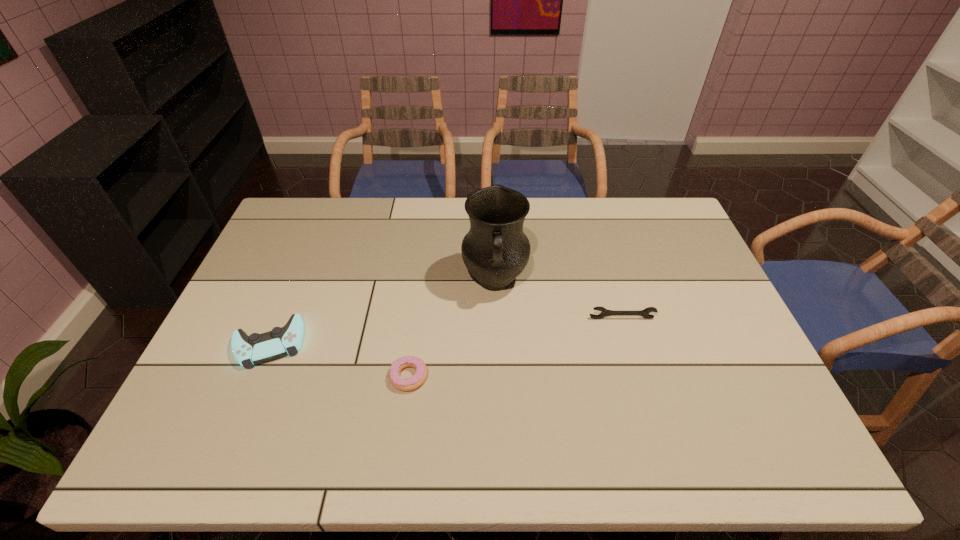
The height and width of the screenshot is (540, 960). I want to click on pitcher, so click(495, 250).

You are a GUI agent. You are given a task and a screenshot of the screen. Output one action in this format:
    pyautogui.click(x=<x>, y=<y>)
    Task: Click on the farthest object
    The height and width of the screenshot is (540, 960).
    Given the screenshot: What is the action you would take?
    pyautogui.click(x=495, y=250)

Where is `control`? control is located at coordinates (257, 348).

I want to click on the rightmost object, so click(x=644, y=313).

Find the location of a particular element. the second farthest object is located at coordinates (644, 313).

The width and height of the screenshot is (960, 540). Find the location of `the second object from left to right`. the second object from left to right is located at coordinates (404, 384).

At what (x,y) coordinates should I click in order to perform the action: click on the shortest object. Please return your answer as a coordinate pair (x, y). This screenshot has height=540, width=960. Looking at the image, I should click on (404, 384).

Where is `vacant space located 0.340m on the handle side of the farthest object`? vacant space located 0.340m on the handle side of the farthest object is located at coordinates (499, 413).

You are a GUI agent. You are given a task and a screenshot of the screen. Output one action in this format:
    pyautogui.click(x=<x>, y=<y>)
    Task: Click on the vacant space located on the right of the leftmost object
    
    Given the screenshot: What is the action you would take?
    pyautogui.click(x=363, y=343)

This screenshot has width=960, height=540. Identify the location of free space located 0.310m on the open ends of the wrench. tap(652, 420).